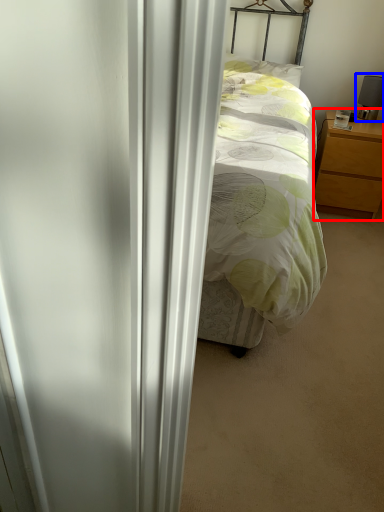
Question: Which point is further to the camera, nightstand (highlighted by a red box) or table lamp (highlighted by a blue box)?

Choices:
 (A) nightstand
 (B) table lamp

Answer: (B)